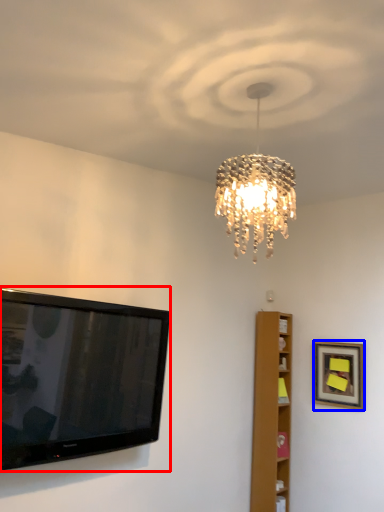
Question: Which object is further to the camera taking this photo, television (highlighted by a red box) or picture frame (highlighted by a blue box)?

Choices:
 (A) television
 (B) picture frame

Answer: (B)